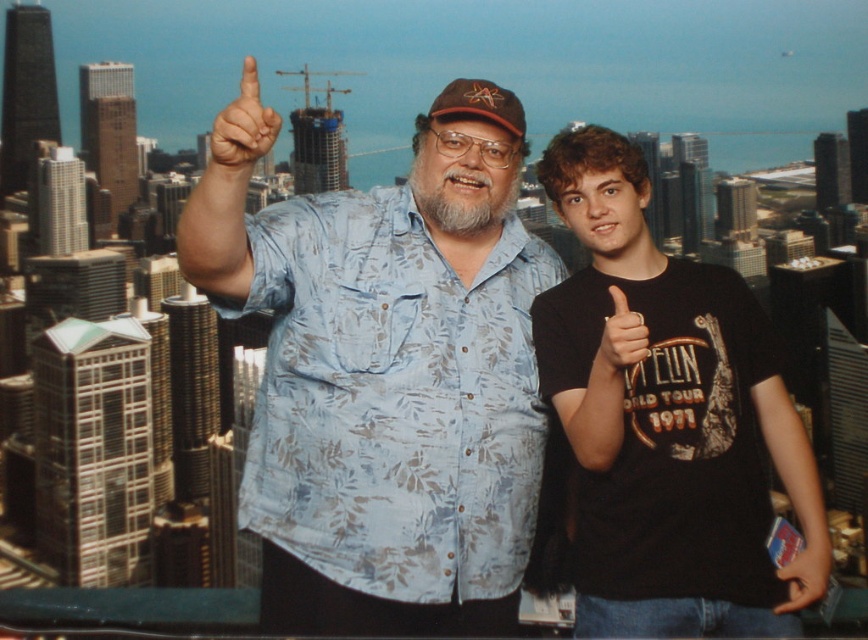
What are the coordinates of the matte blue shirt at upper center in the image?

The coordinates of the matte blue shirt at upper center are at point [242,129].